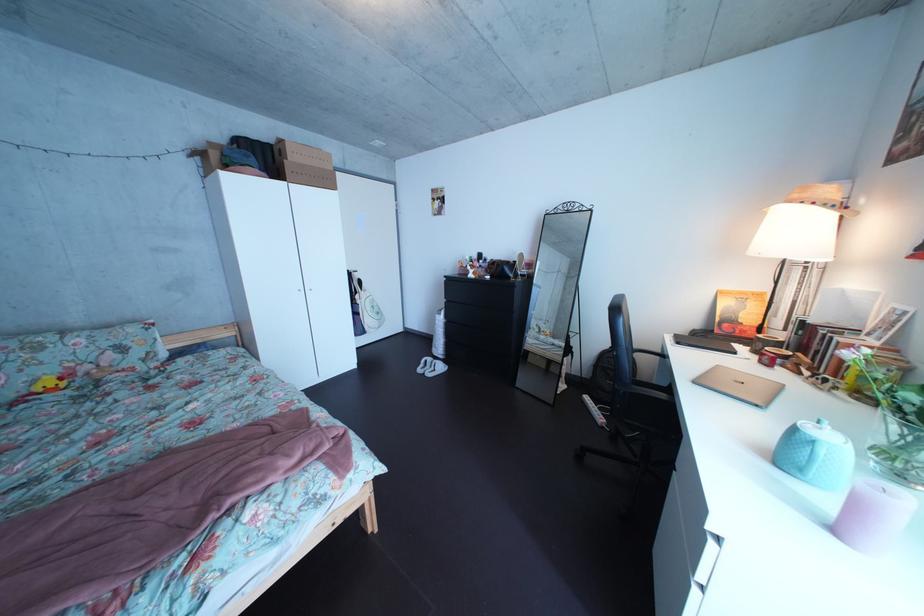
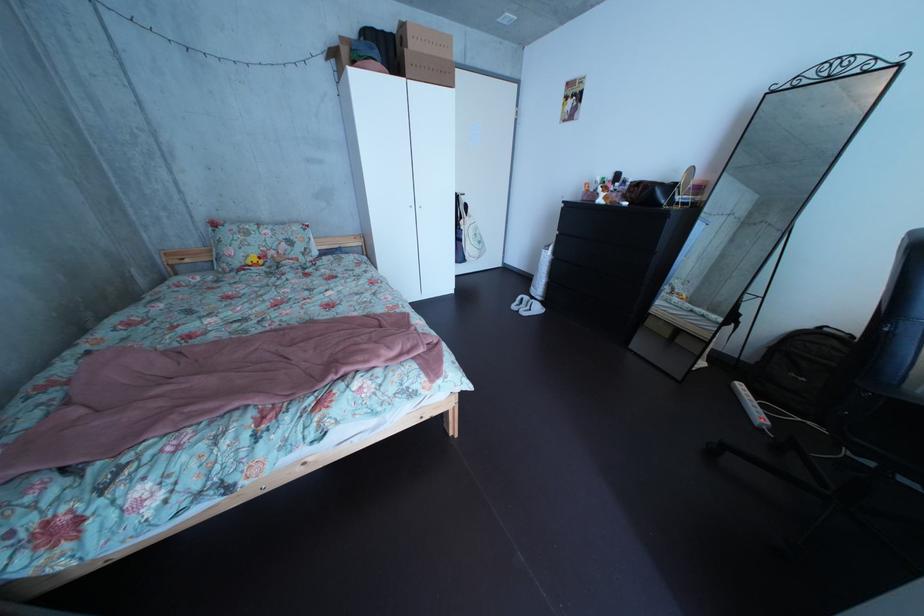
In the second image, find the point that corresponds to point (601, 382) in the first image.

(763, 363)